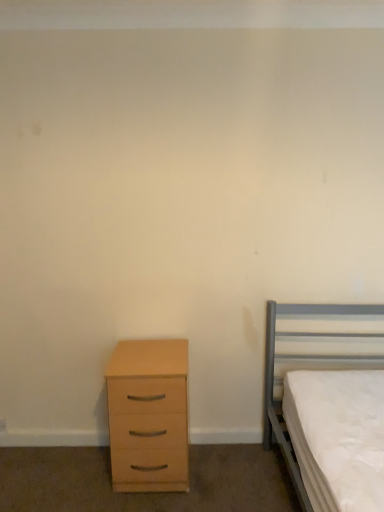
Find the location of `spots to the right of light wood/veneer chest of drawers at lower left`. spots to the right of light wood/veneer chest of drawers at lower left is located at coordinates (223, 470).